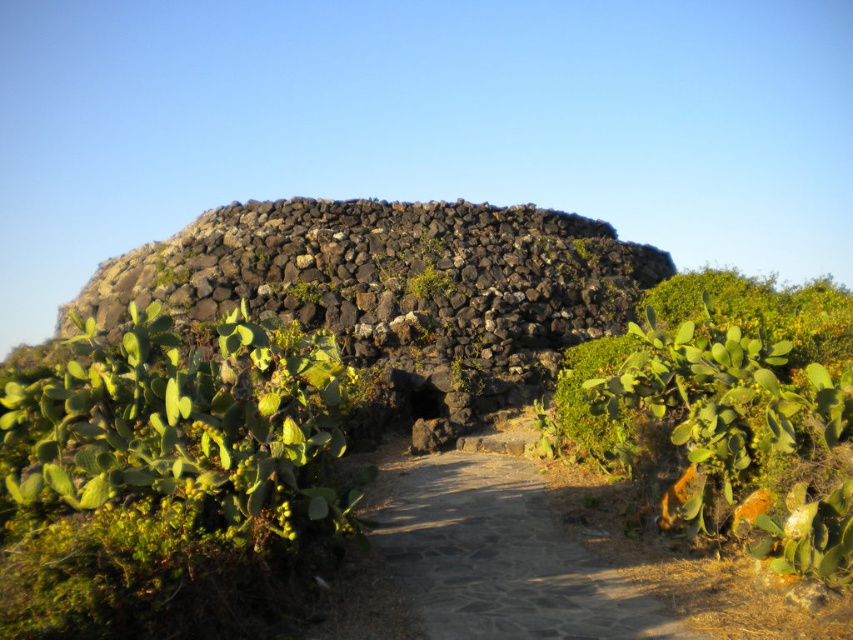
Is green succulent at lower left taller than pebble stone path at center?

Yes, green succulent at lower left is taller than pebble stone path at center.

In the scene shown: How far apart are green succulent at lower left and pebble stone path at center?

green succulent at lower left and pebble stone path at center are 3.45 meters apart.

Locate an element on the screen. The height and width of the screenshot is (640, 853). green succulent at lower left is located at coordinates (167, 477).

Locate an element on the screen. Image resolution: width=853 pixels, height=640 pixels. green succulent at lower left is located at coordinates (167, 477).

Does green succulent at lower left appear on the left side of green mossy plant at center?

Yes, green succulent at lower left is to the left of green mossy plant at center.

Is green succulent at lower left behind green mossy plant at center?

No, green succulent at lower left is closer to the viewer.

This screenshot has width=853, height=640. What do you see at coordinates (167, 477) in the screenshot?
I see `green succulent at lower left` at bounding box center [167, 477].

Where is `green succulent at lower left`? The height and width of the screenshot is (640, 853). green succulent at lower left is located at coordinates (167, 477).

Is green succulent at lower left positioned behind volcanic rock at center?

No, green succulent at lower left is closer to the viewer.

Is point (326, 422) farther from camera compared to point (631, 304)?

No.

You are a GUI agent. You are given a task and a screenshot of the screen. Output one action in this format:
    pyautogui.click(x=<x>, y=<y>)
    Task: Click on the green succulent at lower left
    The height and width of the screenshot is (640, 853).
    Given the screenshot: What is the action you would take?
    pyautogui.click(x=167, y=477)